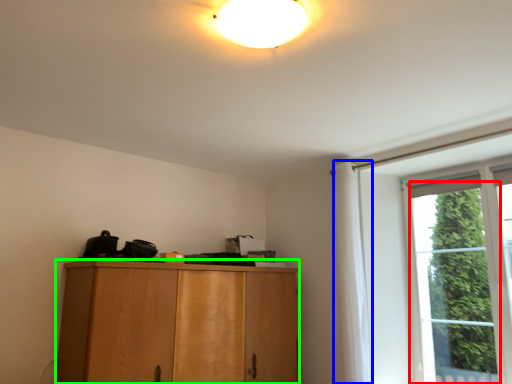
Question: Which is nearer to the window (highlighted by a red box)? curtain (highlighted by a blue box) or cabinetry (highlighted by a green box).

Choices:
 (A) curtain
 (B) cabinetry

Answer: (A)